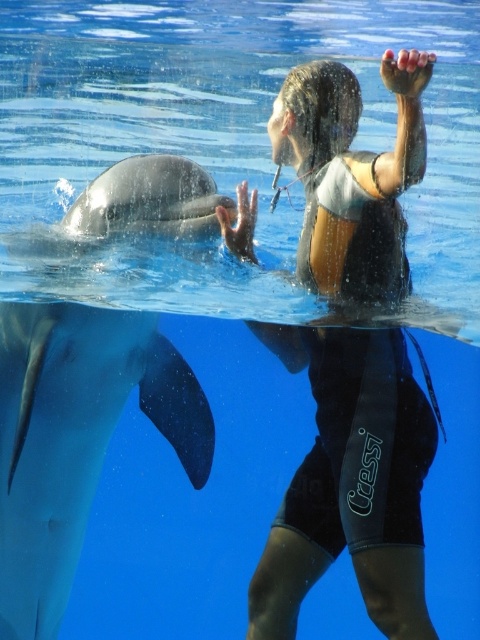
You are a marine biologist analyzing an underwater image. You need to locate the black neoprene wetsuit at upper center for a study. What are its coordinates in the image?

The black neoprene wetsuit at upper center is located at coordinates point (350, 483).

You are a marine biologist observing the underwater scene. You notice two dolphins labeled as smooth gray dolphin at left and gray smooth dolphin at left. Which dolphin is positioned closer to the observer?

The smooth gray dolphin at left is closer to the observer because the gray smooth dolphin at left is positioned behind it.